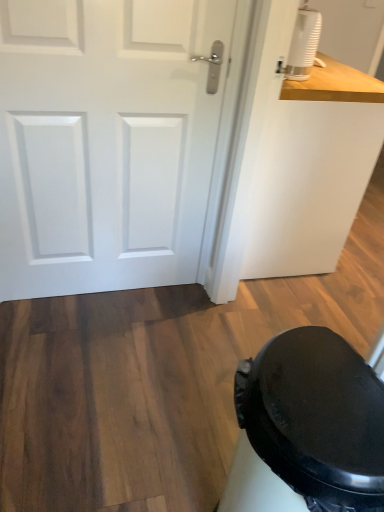
Question: Considering the relative positions of white matte door at upper left and white matte humidifier at upper right in the image provided, is white matte door at upper left to the left or to the right of white matte humidifier at upper right?

Choices:
 (A) right
 (B) left

Answer: (B)

Question: Relative to white matte humidifier at upper right, is white matte door at upper left in front or behind?

Choices:
 (A) behind
 (B) front

Answer: (B)

Question: Which object is positioned farthest from the black matte potty at lower right?

Choices:
 (A) white matte door at upper left
 (B) white matte humidifier at upper right

Answer: (B)

Question: Which object is positioned closest to the white matte humidifier at upper right?

Choices:
 (A) white matte door at upper left
 (B) black matte potty at lower right

Answer: (A)